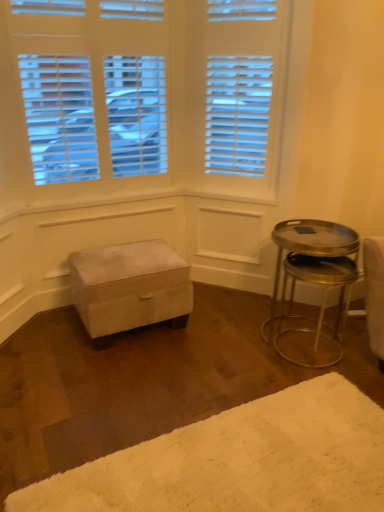
Question: Considering the positions of white fluffy rug at lower right and velvet ottoman at center in the image, is white fluffy rug at lower right wider or thinner than velvet ottoman at center?

Choices:
 (A) wide
 (B) thin

Answer: (A)

Question: Would you say white fluffy rug at lower right is inside or outside velvet ottoman at center?

Choices:
 (A) outside
 (B) inside

Answer: (A)

Question: Which object is the closest to the metallic silver table at right?

Choices:
 (A) white fluffy rug at lower right
 (B) velvet ottoman at center

Answer: (A)

Question: Considering the real-world distances, which object is closest to the white fluffy rug at lower right?

Choices:
 (A) metallic silver table at right
 (B) velvet ottoman at center

Answer: (A)